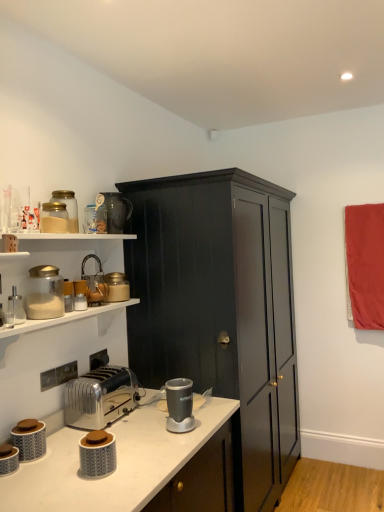
Question: Is matte gray canister at lower left, which ranks as the 1th appliance in bottom-to-top order, wider or thinner than matte glass jar at upper left, the 11th appliance ordered from the bottom?

Choices:
 (A) thin
 (B) wide

Answer: (A)

Question: In the image, is matte gray canister at lower left, the 11th appliance when ordered from top to bottom, positioned in front of or behind matte glass jar at upper left, the 11th appliance ordered from the bottom?

Choices:
 (A) behind
 (B) front

Answer: (B)

Question: Based on their relative distances, which object is farther from the clear glass salt shaker at left, positioned as the 5th appliance in bottom-to-top order?

Choices:
 (A) white plastic toaster at lower left
 (B) matte gray canister at lower left, arranged as the 2th appliance when ordered from the bottom
 (C) matte gray canister at lower left, the 11th appliance when ordered from top to bottom
 (D) dark wood cabinet at center
 (E) metallic gray blender at center, the fourth appliance when ordered from bottom to top

Answer: (D)

Question: Which is farther from the matte glass jar at upper left, the 11th appliance ordered from the bottom?

Choices:
 (A) matte gray canister at lower left, the 10th appliance when ordered from top to bottom
 (B) metallic faucet at upper left, the third appliance viewed from the top
 (C) white plastic toaster at lower left
 (D) matte gray canister at lower left, the 11th appliance when ordered from top to bottom
 (E) matte gray jar at lower left, arranged as the ninth appliance when viewed from the top

Answer: (D)